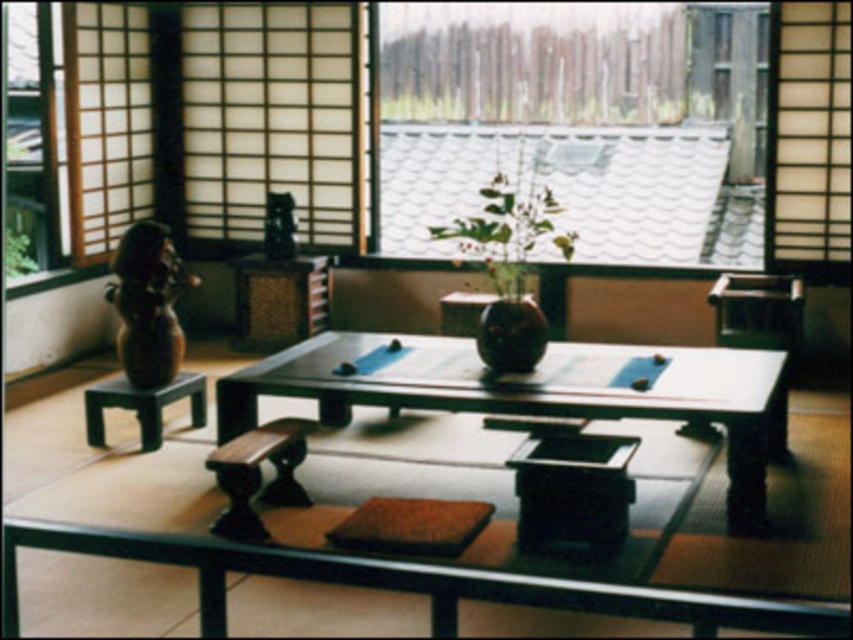
Question: Estimate the real-world distances between objects in this image. Which object is closer to the transparent glass window at upper center?

Choices:
 (A) smooth dark wood table at center
 (B) matte brown vase at center

Answer: (A)

Question: Can you confirm if transparent glass window at upper center is thinner than matte brown vase at center?

Choices:
 (A) no
 (B) yes

Answer: (A)

Question: Which object is the closest to the smooth dark wood table at center?

Choices:
 (A) matte brown vase at center
 (B) transparent glass window at upper center

Answer: (A)

Question: In this image, where is smooth dark wood table at center located relative to matte brown vase at center?

Choices:
 (A) above
 (B) below

Answer: (B)

Question: Which object is positioned farthest from the smooth dark wood table at center?

Choices:
 (A) matte brown vase at center
 (B) transparent glass window at upper center

Answer: (B)

Question: Does transparent glass window at upper center have a larger size compared to matte brown vase at center?

Choices:
 (A) no
 (B) yes

Answer: (B)